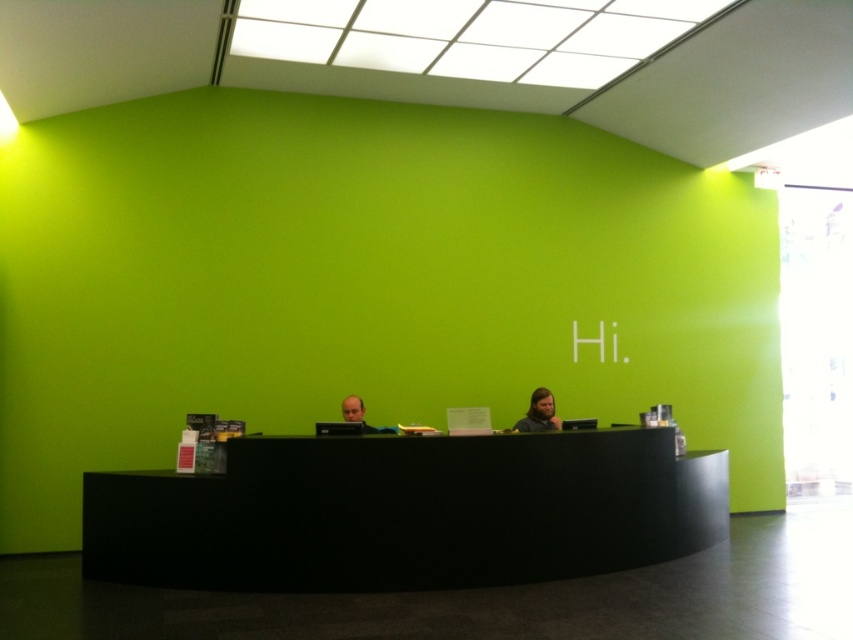
You are a receptionist who needs to place a 1.2 meter tall potted plant on the black matte desk at center. Considering the desk and the dark brown hair at center, will the plant be visible from the front entrance?

The black matte desk at center has a greater height compared to dark brown hair at center. Since the desk is taller, the 1.2 meter tall potted plant placed on it would likely be visible from the front entrance as it rises above the dark brown hair at center.

You are a visitor entering the reception area and need to approach the black matte desk at center. There is a dark brown hair at center on the desk. Is the desk large enough to accommodate both the hair and your belongings?

The black matte desk at center has a larger size compared to dark brown hair at center, so yes, the desk is large enough to accommodate both the hair and your belongings.

You are standing in the reception area and want to know how far the point at coordinates (531, 420) is from your current position. Can you determine the distance?

The point at coordinates (531, 420) is 6.29 meters away from the camera, so the distance from your current position would be approximately 6.29 meters.